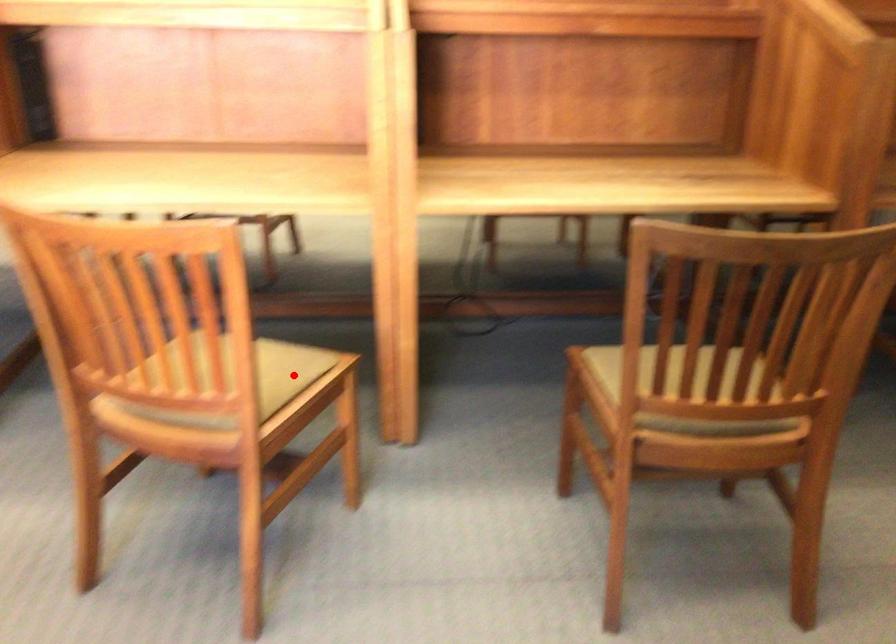
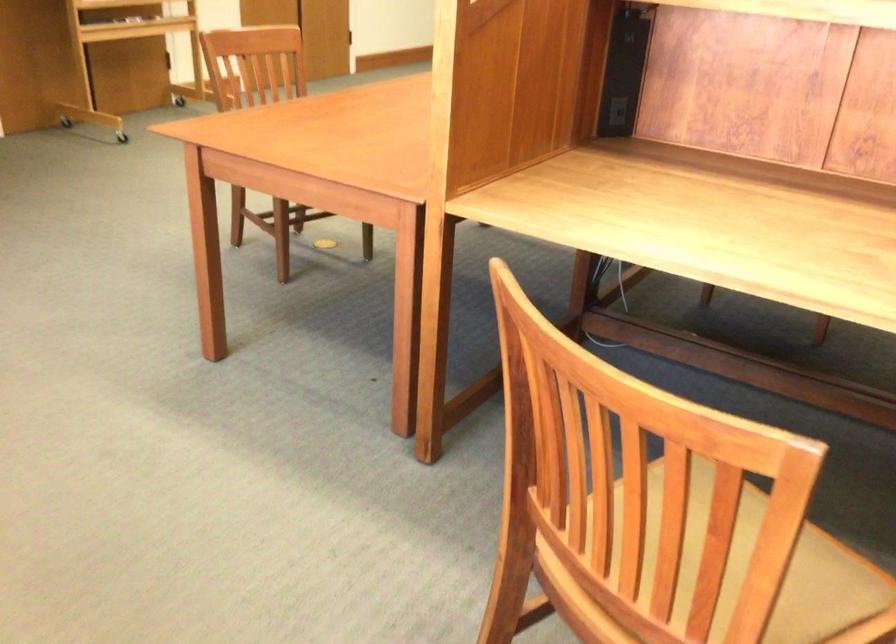
Question: I am providing you with two images of the same scene from different viewpoints. Given a red point in image1, look at the same physical point in image2. Is it:

Choices:
 (A) Closer to the viewpoint
 (B) Farther from the viewpoint

Answer: (A)